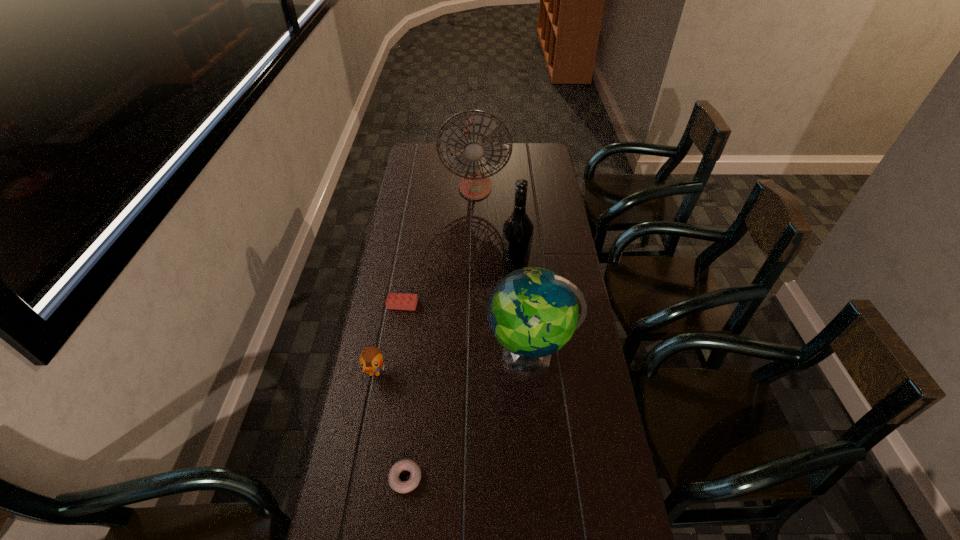
Image resolution: width=960 pixels, height=540 pixels. Find the location of `free space located 0.230m on the label of the second farthest object`. free space located 0.230m on the label of the second farthest object is located at coordinates (443, 266).

Find the location of `vacant area situated on the label of the second farthest object`. vacant area situated on the label of the second farthest object is located at coordinates (417, 266).

Locate an element on the screen. Image resolution: width=960 pixels, height=540 pixels. vacant position located on the front surface of the globe is located at coordinates (370, 355).

Where is `free space located 0.080m on the front surface of the globe`? This screenshot has width=960, height=540. free space located 0.080m on the front surface of the globe is located at coordinates (462, 355).

Identify the location of vacant space located 0.300m on the front surface of the globe. (395, 355).

The image size is (960, 540). In order to click on free spot located 0.330m on the front-facing side of the fourth tallest object in this screenshot , I will do `click(350, 502)`.

The width and height of the screenshot is (960, 540). Find the location of `vacant space located 0.320m on the right of the fifth tallest object`. vacant space located 0.320m on the right of the fifth tallest object is located at coordinates (506, 305).

Where is `vacant space located 0.270m on the back of the nearest object`? The image size is (960, 540). vacant space located 0.270m on the back of the nearest object is located at coordinates (418, 375).

Where is `duck present at the left edge`? Image resolution: width=960 pixels, height=540 pixels. duck present at the left edge is located at coordinates (371, 359).

At what (x,y) coordinates should I click in order to perform the action: click on Lego present at the left edge. Please return your answer as a coordinate pair (x, y). Looking at the image, I should click on (400, 301).